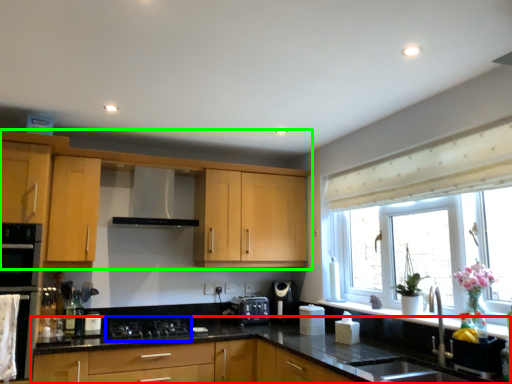
Question: Based on their relative distances, which object is nearer to countertop (highlighted by a red box)? Choose from gas stove (highlighted by a blue box) and cabinetry (highlighted by a green box).

Choices:
 (A) gas stove
 (B) cabinetry

Answer: (A)